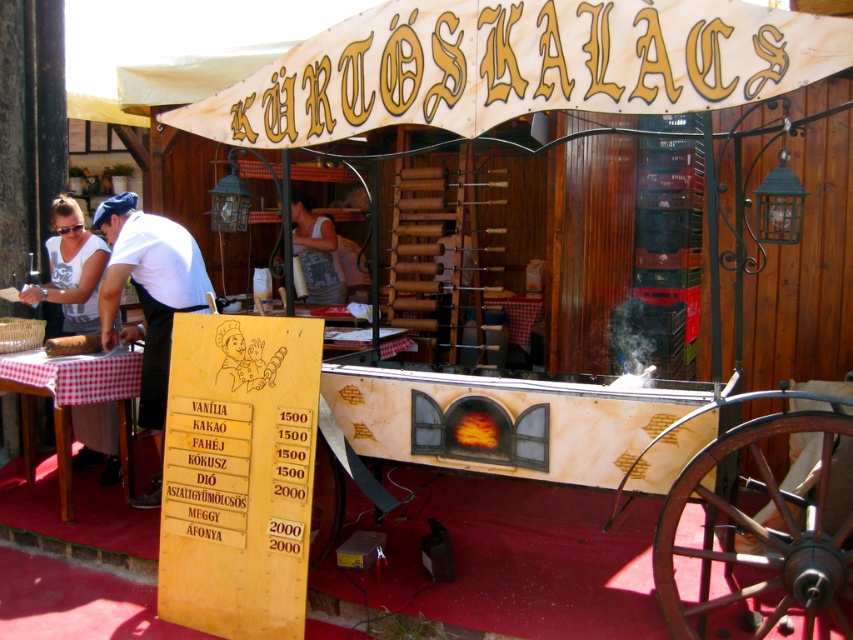
Looking at this image, you are standing at the center of the food stall. Which direction should you look to see the white fabric shirt at left?

The white fabric shirt at left is located at the left side of the stall, so you should look to your left to see it.

You are a customer at the Kurtoskalacs stall and you want to order a chimney cake. You notice a white shirt at left and a brown wood log at lower left. Which object is closer to the ground?

The white shirt at left is located below brown wood log at lower left, so the white shirt at left is closer to the ground.